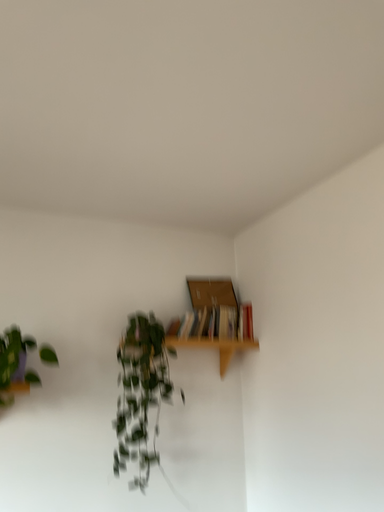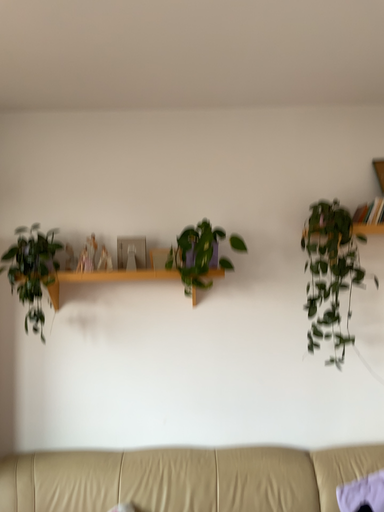
Question: How did the camera likely rotate when shooting the video?

Choices:
 (A) rotated upward
 (B) rotated downward

Answer: (B)